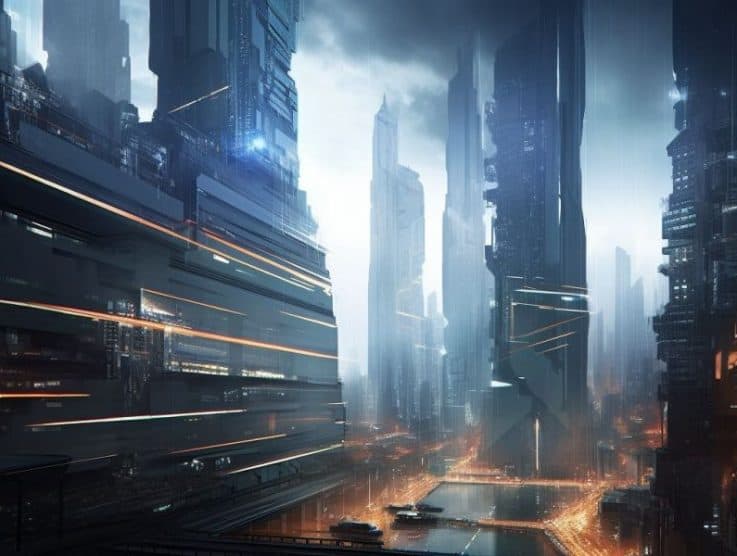
Find the location of a particular element. This screenshot has height=556, width=737. spot light is located at coordinates (674, 94).